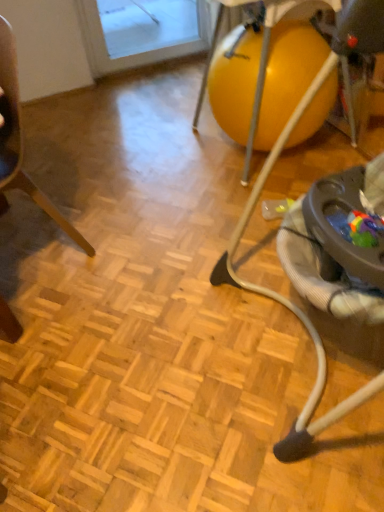
Describe the element at coordinates (20, 141) in the screenshot. This screenshot has width=384, height=512. I see `wooden chair at left` at that location.

In the scene shown: What is the approximate width of wooden chair at left?

15.10 inches.

Measure the distance between point (14, 318) and camera.

Point (14, 318) and camera are 4.72 feet apart.

Find the location of `wooden chair at left`. wooden chair at left is located at coordinates (20, 141).

This screenshot has height=512, width=384. Find the location of `wooden chair at left`. wooden chair at left is located at coordinates pyautogui.click(x=20, y=141).